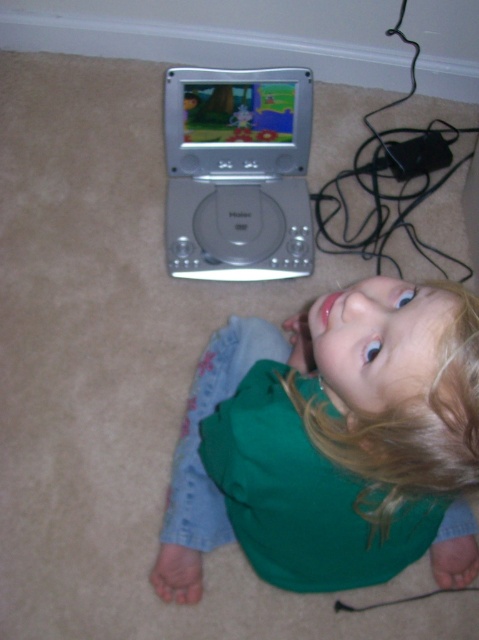
Is point (380, 404) more distant than point (296, 240)?

No.

Who is higher up, green fabric shirt at lower center or silver metallic portable dvd player at upper center?

silver metallic portable dvd player at upper center is higher up.

What are the coordinates of `green fabric shirt at lower center` in the screenshot? It's located at (338, 432).

The image size is (479, 640). In order to click on green fabric shirt at lower center in this screenshot , I will do [338, 432].

Is silver metallic dvd player at upper center smaller than silver metallic portable dvd player at upper center?

Incorrect, silver metallic dvd player at upper center is not smaller in size than silver metallic portable dvd player at upper center.

The image size is (479, 640). Identify the location of silver metallic dvd player at upper center. (237, 120).

Which is behind, point (266, 362) or point (238, 150)?

The point (238, 150) is behind.

This screenshot has width=479, height=640. What are the coordinates of `green fabric shirt at lower center` in the screenshot? It's located at (338, 432).

Describe the element at coordinates (338, 432) in the screenshot. The height and width of the screenshot is (640, 479). I see `green fabric shirt at lower center` at that location.

Identify the location of green fabric shirt at lower center. This screenshot has width=479, height=640. (338, 432).